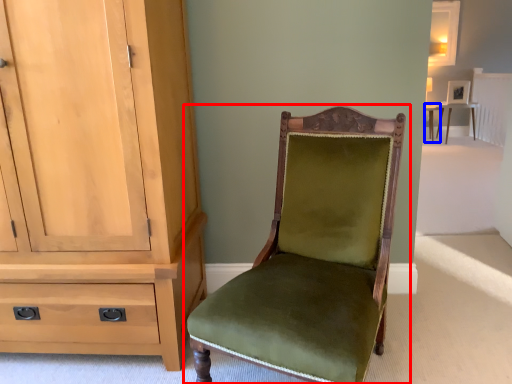
Question: Among these objects, which one is nearest to the camera, chair (highlighted by a red box) or table (highlighted by a blue box)?

Choices:
 (A) chair
 (B) table

Answer: (A)